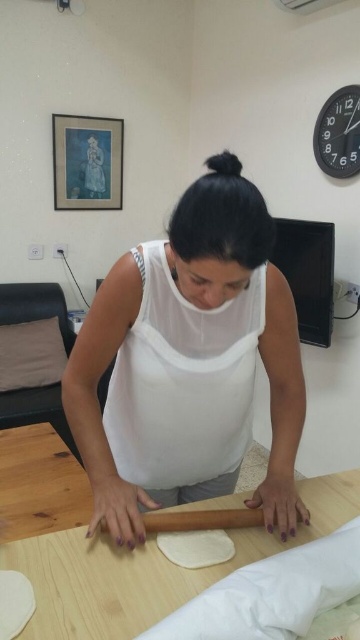
Question: Which of these objects is positioned farthest from the wooden table at center?

Choices:
 (A) white matte tank top at center
 (B) white fabric apron at center
 (C) wooden rolling pin at center
 (D) white dough at center

Answer: (B)

Question: Can you confirm if white matte tank top at center is thinner than wooden rolling pin at center?

Choices:
 (A) yes
 (B) no

Answer: (B)

Question: Which point is farther to the camera?

Choices:
 (A) white fabric apron at center
 (B) white dough at center
 (C) wooden table at center

Answer: (B)

Question: Where is white fabric apron at center located in relation to wooden table at center in the image?

Choices:
 (A) above
 (B) below

Answer: (A)

Question: Is white matte tank top at center bigger than white dough at center?

Choices:
 (A) yes
 (B) no

Answer: (A)

Question: Which point is closer to the camera?

Choices:
 (A) (68, 624)
 (B) (164, 548)

Answer: (A)